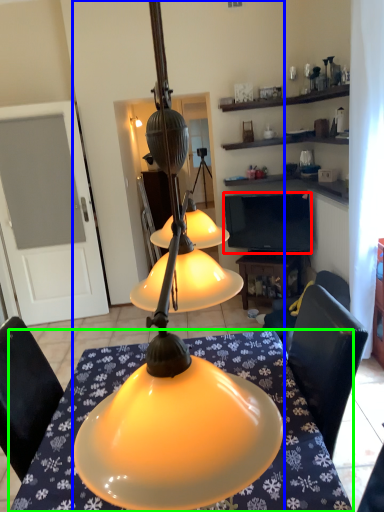
Question: Which object is positioned closest to television (highlighted by a red box)? Select from lamp (highlighted by a blue box) and desk (highlighted by a green box).

Choices:
 (A) lamp
 (B) desk

Answer: (B)